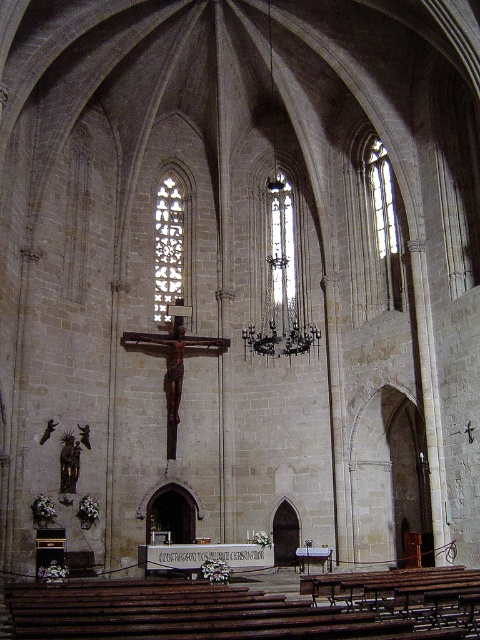
Question: From the image, what is the correct spatial relationship of clear glass stained glass window at center in relation to clear glass window at center?

Choices:
 (A) right
 (B) left

Answer: (B)

Question: Which object is farther from the camera taking this photo?

Choices:
 (A) clear glass window at center
 (B) clear glass stained glass window at center
 (C) clear glass window at upper right
 (D) dark bronze chandelier at center

Answer: (B)

Question: Which of the following is the farthest from the observer?

Choices:
 (A) (277, 317)
 (B) (391, 250)
 (C) (172, 196)
 (D) (251, 337)

Answer: (C)

Question: Does clear glass stained glass window at center appear over clear glass window at upper right?

Choices:
 (A) yes
 (B) no

Answer: (B)

Question: Observing the image, what is the correct spatial positioning of dark bronze chandelier at center in reference to clear glass window at center?

Choices:
 (A) above
 (B) below

Answer: (B)

Question: Which point appears farthest from the camera in this image?

Choices:
 (A) (277, 218)
 (B) (175, 225)
 (C) (287, 193)

Answer: (C)